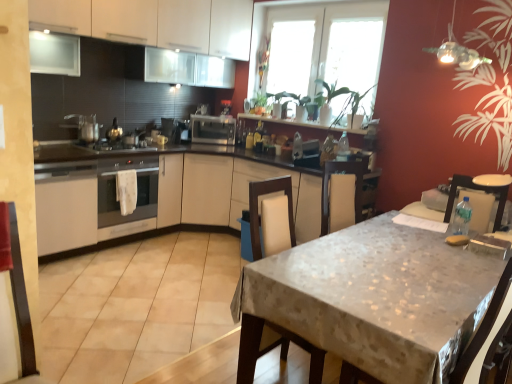
Locate an element on the screen. vacant space situated on the left part of beige fabric swivel chair at lower right, acting as the second swivel chair starting from the right is located at coordinates (204, 356).